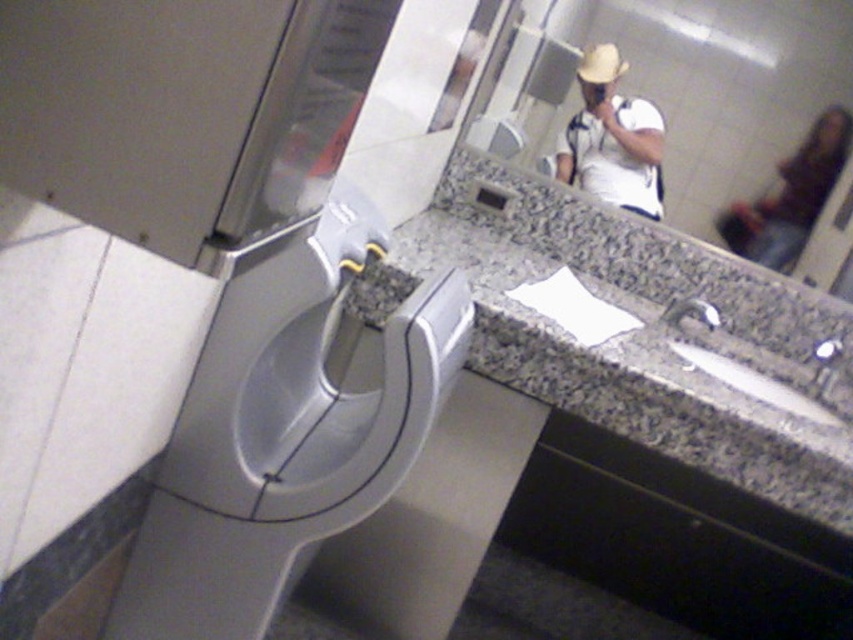
Does satin silver urinal at lower left appear under reflective glass mirror at upper center?

Indeed, satin silver urinal at lower left is positioned under reflective glass mirror at upper center.

Is satin silver urinal at lower left shorter than reflective glass mirror at upper center?

Incorrect, satin silver urinal at lower left's height does not fall short of reflective glass mirror at upper center's.

The width and height of the screenshot is (853, 640). Describe the element at coordinates (283, 433) in the screenshot. I see `satin silver urinal at lower left` at that location.

Where is `satin silver urinal at lower left`? The width and height of the screenshot is (853, 640). satin silver urinal at lower left is located at coordinates (283, 433).

Is reflective glass mirror at upper center above white matte shirt at upper center?

Yes, reflective glass mirror at upper center is above white matte shirt at upper center.

Looking at this image, which is below, reflective glass mirror at upper center or white matte shirt at upper center?

white matte shirt at upper center is below.

Who is more distant from viewer, (730, 54) or (573, 172)?

Point (573, 172)

Find the location of a particular element. reflective glass mirror at upper center is located at coordinates (722, 84).

Does satin silver urinal at lower left have a greater width compared to dark brown leather jacket at upper right?

Indeed, satin silver urinal at lower left has a greater width compared to dark brown leather jacket at upper right.

Is point (303, 476) less distant than point (780, 188)?

Yes, point (303, 476) is in front of point (780, 188).

At what (x,y) coordinates should I click in order to perform the action: click on satin silver urinal at lower left. Please return your answer as a coordinate pair (x, y). This screenshot has height=640, width=853. Looking at the image, I should click on (283, 433).